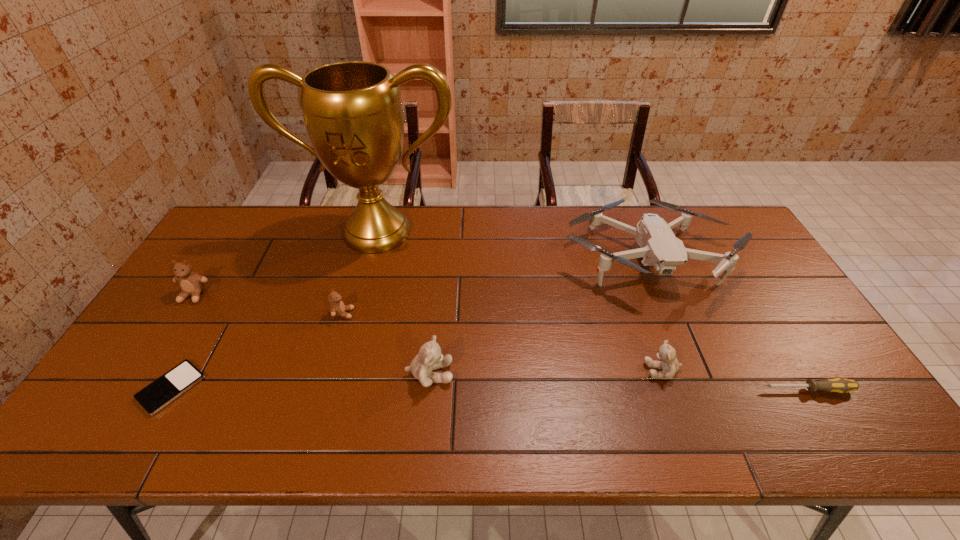
Where is `teddy bear that is at the left edge`? Image resolution: width=960 pixels, height=540 pixels. teddy bear that is at the left edge is located at coordinates (191, 284).

Where is `iPod located in the left edge section of the desktop`? iPod located in the left edge section of the desktop is located at coordinates (164, 390).

Find the location of a particular element. The width and height of the screenshot is (960, 540). drone that is positioned at the right edge is located at coordinates (660, 248).

Where is `screwdriver positioned at the right edge`? screwdriver positioned at the right edge is located at coordinates (840, 385).

This screenshot has height=540, width=960. What are the coordinates of `object situated at the near left corner` in the screenshot? It's located at (164, 390).

Find the location of a particular element. This screenshot has height=540, width=960. object at the far right corner is located at coordinates (660, 248).

You are a GUI agent. You are given a task and a screenshot of the screen. Output one action in this format:
    pyautogui.click(x=<x>, y=<y>)
    Task: Click on the free location at the far edge of the desktop
    Image resolution: width=960 pixels, height=540 pixels.
    Given the screenshot: What is the action you would take?
    pyautogui.click(x=568, y=226)

Identify the location of free space at the near edge. This screenshot has height=540, width=960. (196, 423).

Image resolution: width=960 pixels, height=540 pixels. I want to click on free region at the left edge of the desktop, so click(205, 338).

The image size is (960, 540). In order to click on blank space at the right edge of the desktop in this screenshot , I will do [x=755, y=256].